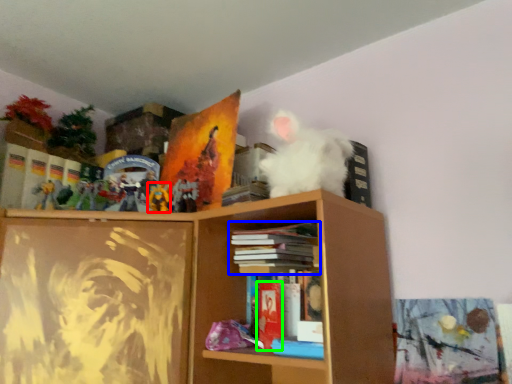
Question: Which object is positioned closest to toy (highlighted by a red box)? Select from book (highlighted by a blue box) and paperback book (highlighted by a green box).

Choices:
 (A) book
 (B) paperback book

Answer: (A)